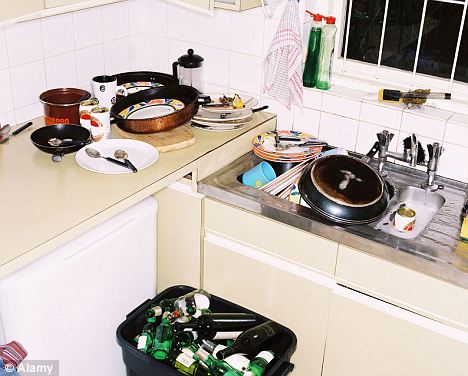
Where is `faucet`? The image size is (468, 376). faucet is located at coordinates (430, 169).